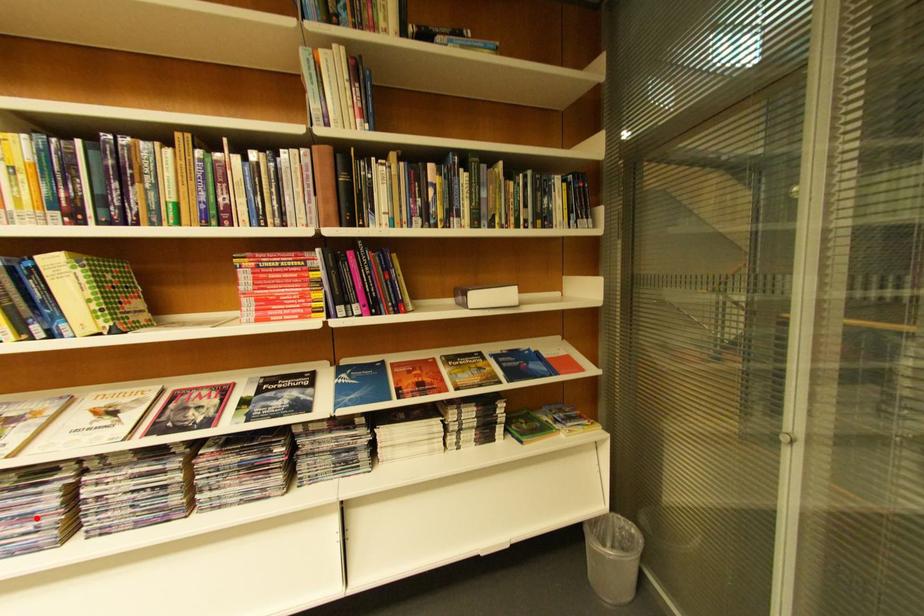
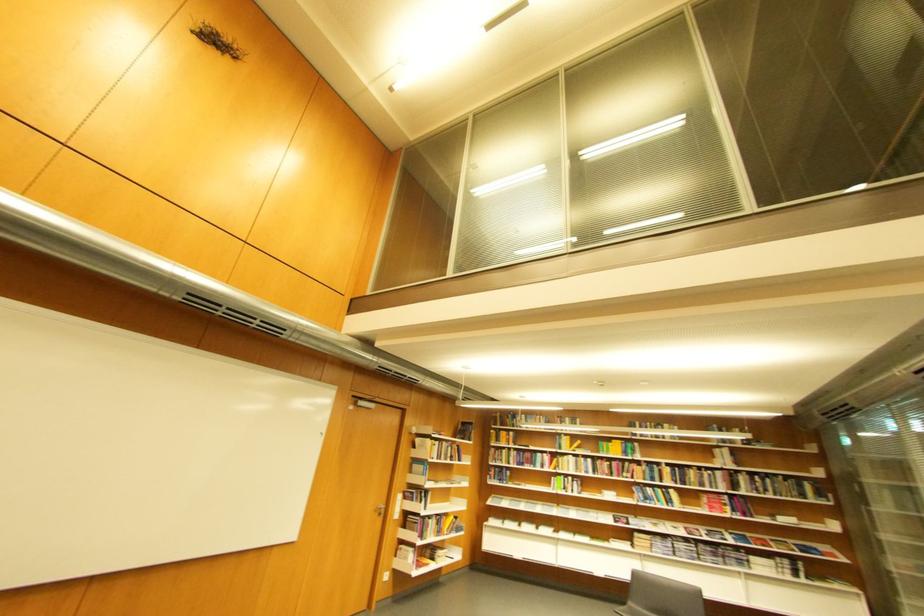
In the second image, find the point that corresponds to the highlighted location in the first image.

(677, 549)